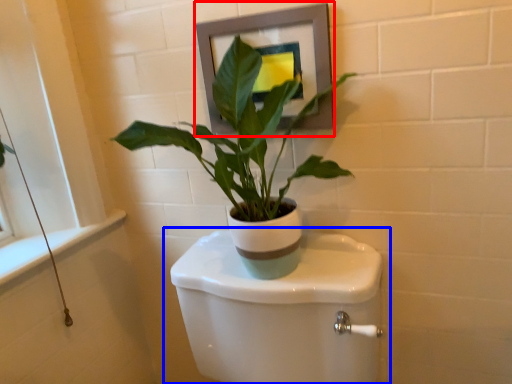
Question: Which object is closer to the camera taking this photo, picture frame (highlighted by a red box) or toilet (highlighted by a blue box)?

Choices:
 (A) picture frame
 (B) toilet

Answer: (B)